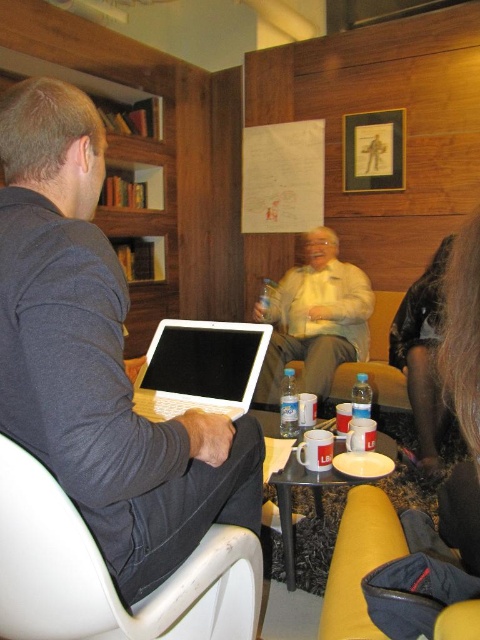
Is point (233, 472) farther from viewer compared to point (297, 362)?

No, it is in front of (297, 362).

This screenshot has width=480, height=640. In order to click on matte black laptop at left in this screenshot , I will do `click(97, 358)`.

Where is `matte black laptop at left`? The height and width of the screenshot is (640, 480). matte black laptop at left is located at coordinates (97, 358).

Which is more to the left, matte white shirt at center or wooden bookshelf at left?

From the viewer's perspective, wooden bookshelf at left appears more on the left side.

How much distance is there between matte white shirt at center and wooden bookshelf at left?

matte white shirt at center is 4.29 feet from wooden bookshelf at left.

Where is `matte white shirt at center`? The width and height of the screenshot is (480, 640). matte white shirt at center is located at coordinates pyautogui.click(x=314, y=317).

Locate an element on the screen. matte white shirt at center is located at coordinates (314, 317).

Is white plastic armchair at left bigger than black silky hair at lower right?

Incorrect, white plastic armchair at left is not larger than black silky hair at lower right.

Based on the photo, can you confirm if white plastic armchair at left is smaller than black silky hair at lower right?

Yes.

You are a GUI agent. You are given a task and a screenshot of the screen. Output one action in this format:
    pyautogui.click(x=<x>, y=<y>)
    Task: Click on the white plastic armchair at left
    
    Given the screenshot: What is the action you would take?
    pyautogui.click(x=108, y=572)

The height and width of the screenshot is (640, 480). I want to click on white plastic armchair at left, so click(x=108, y=572).